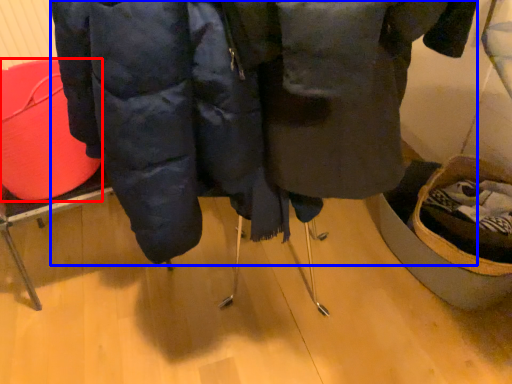
Question: Which point is further to the camera, basket (highlighted by a red box) or jacket (highlighted by a blue box)?

Choices:
 (A) basket
 (B) jacket

Answer: (A)